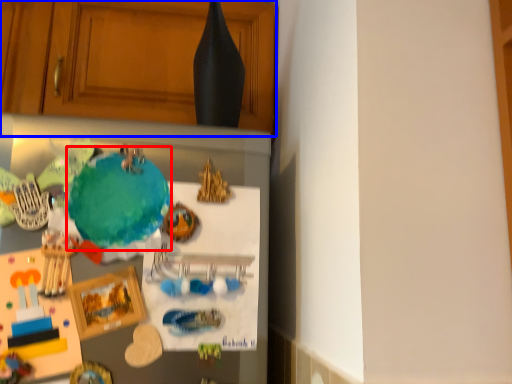
Question: Which of the following is the farthest to the observer, teal (highlighted by a red box) or cabinetry (highlighted by a blue box)?

Choices:
 (A) teal
 (B) cabinetry

Answer: (B)